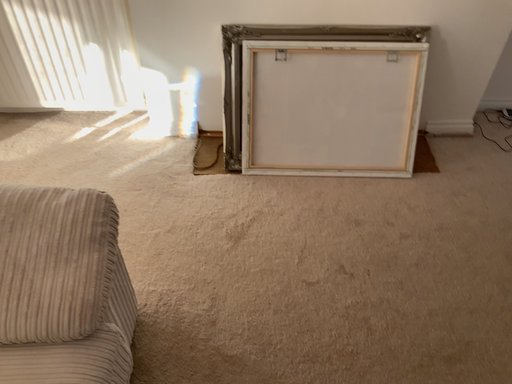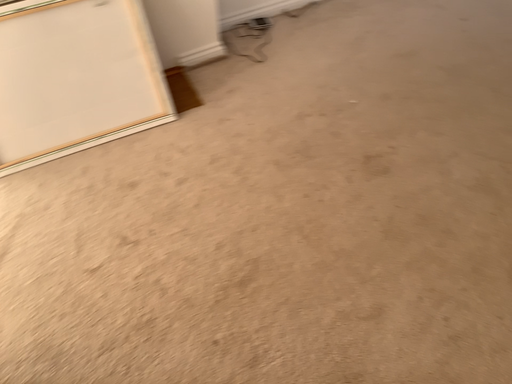
Question: How did the camera likely rotate when shooting the video?

Choices:
 (A) rotated left
 (B) rotated right

Answer: (B)